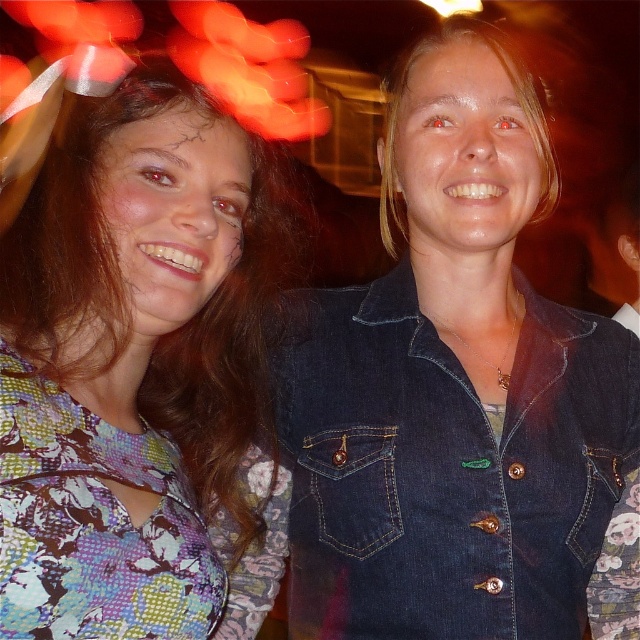
Between point (307, 625) and point (154, 625), which one is positioned in front?

Positioned in front is point (154, 625).

Does denim jacket at lower right appear under floral fabric dress at left?

Yes.

Who is more forward, (x=525, y=422) or (x=141, y=109)?

Point (x=141, y=109) is more forward.

Where is `denim jacket at lower right`? The width and height of the screenshot is (640, 640). denim jacket at lower right is located at coordinates (448, 467).